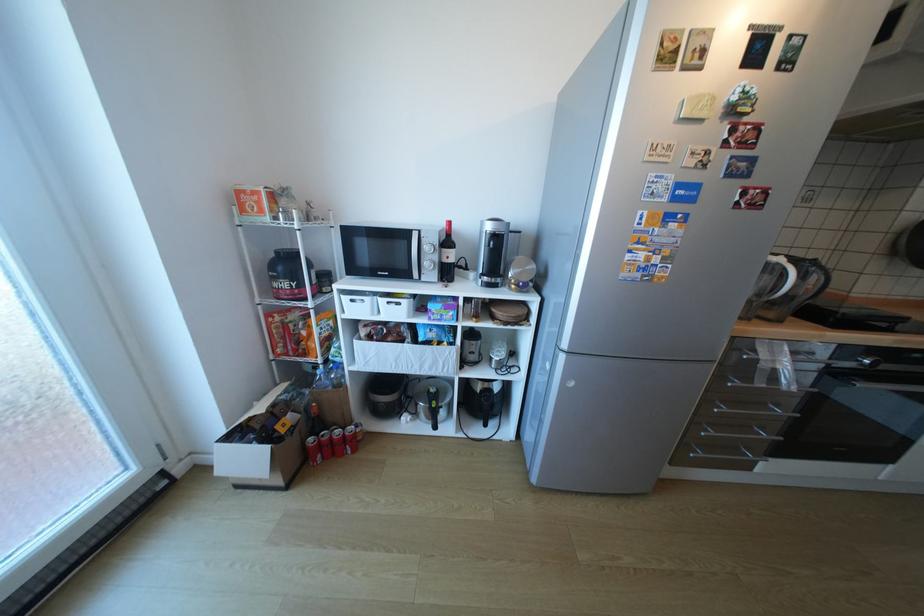
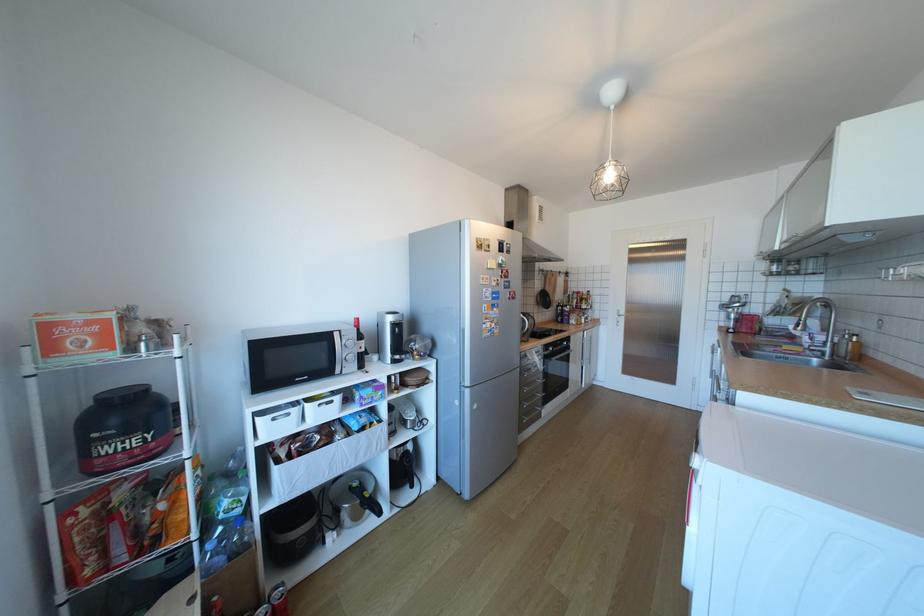
The point at (x=438, y=406) is marked in the first image. Where is the corresponding point in the second image?

(369, 501)